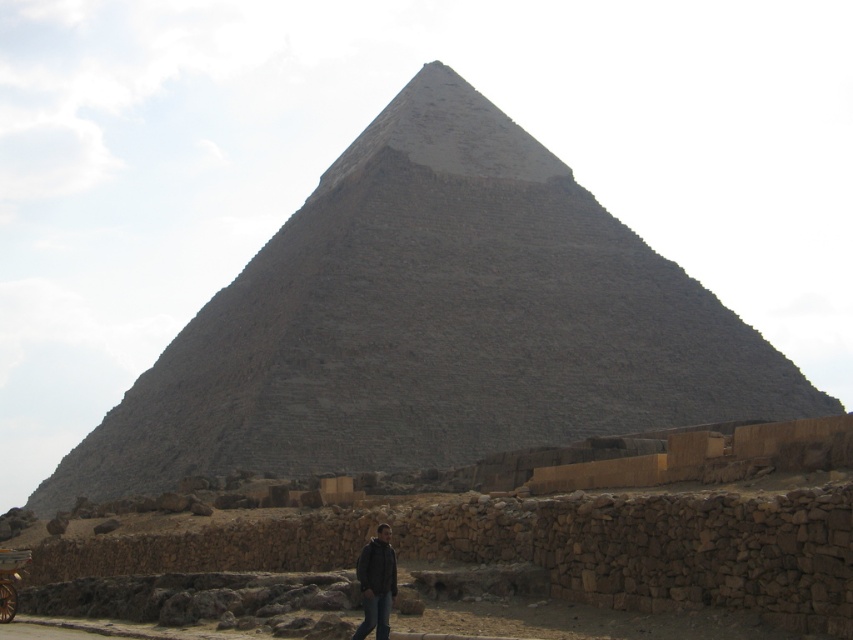
You are standing at the base of the pyramid and want to walk to the point marked as point (366, 602). Which direction should you move relative to the point marked as point (345, 324)?

You should move away from the point (345, 324) because it is closer to you than the point (366, 602), so moving away from it will bring you toward the desired point.

You are standing at the base of the gray stone pyramid at center and want to reach the top. If your walking speed is 3 feet per second, how long will it take you to climb to the top?

The gray stone pyramid at center is 459.52 feet away from the viewer. At a walking speed of 3 feet per second, it would take approximately 153.17 seconds to reach the top.